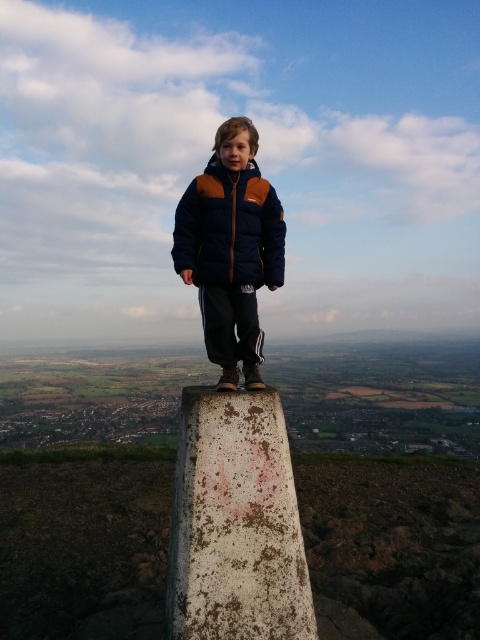
You are a hiker who wants to take a photo of the trig point. You see the white weathered stone at center and the navy blue down jacket at center. Which object should you focus on to ensure the trig point is clearly visible in your photo?

The white weathered stone at center is positioned under the navy blue down jacket at center, so focusing on the white weathered stone at center will ensure the trig point is clearly visible in your photo.